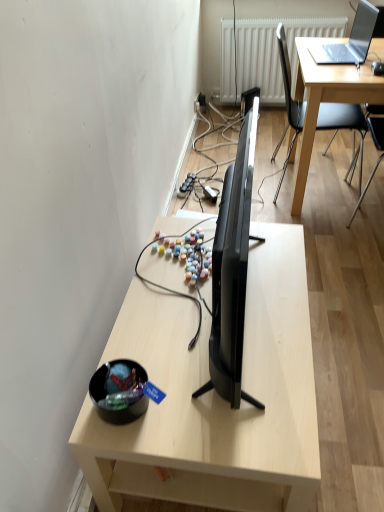
Question: Should I look upward or downward to see white textured radiator at upper center?

Choices:
 (A) up
 (B) down

Answer: (A)

Question: Does shiny black bowl at lower left appear on the right side of black glossy tv at center?

Choices:
 (A) yes
 (B) no

Answer: (B)

Question: Is shiny black bowl at lower left oriented away from black glossy tv at center?

Choices:
 (A) no
 (B) yes

Answer: (A)

Question: From a real-world perspective, is shiny black bowl at lower left physically below black glossy tv at center?

Choices:
 (A) yes
 (B) no

Answer: (A)

Question: Is shiny black bowl at lower left at the left side of black glossy tv at center?

Choices:
 (A) no
 (B) yes

Answer: (B)

Question: Does shiny black bowl at lower left have a lesser width compared to black glossy tv at center?

Choices:
 (A) yes
 (B) no

Answer: (A)

Question: Considering the relative sizes of shiny black bowl at lower left and black glossy tv at center in the image provided, is shiny black bowl at lower left wider than black glossy tv at center?

Choices:
 (A) yes
 (B) no

Answer: (B)

Question: Is black glossy tv at center wider than black plastic chair at upper right?

Choices:
 (A) yes
 (B) no

Answer: (B)

Question: From the image's perspective, is black glossy tv at center located beneath black plastic chair at upper right?

Choices:
 (A) no
 (B) yes

Answer: (B)

Question: Is black glossy tv at center at the left side of black plastic chair at upper right?

Choices:
 (A) yes
 (B) no

Answer: (A)

Question: Does black glossy tv at center turn towards black plastic chair at upper right?

Choices:
 (A) yes
 (B) no

Answer: (B)

Question: Is black plastic chair at upper right completely or partially inside black glossy tv at center?

Choices:
 (A) no
 (B) yes

Answer: (A)

Question: Is black glossy tv at center next to black plastic chair at upper right?

Choices:
 (A) no
 (B) yes

Answer: (A)

Question: From a real-world perspective, is light wood desk at center physically below black glossy tv at center?

Choices:
 (A) yes
 (B) no

Answer: (A)